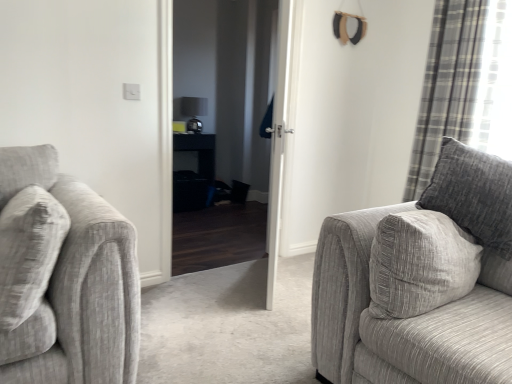
Question: Is black glossy table at center wider than white glossy door at center?

Choices:
 (A) no
 (B) yes

Answer: (B)

Question: Considering the relative sizes of black glossy table at center and white glossy door at center in the image provided, is black glossy table at center smaller than white glossy door at center?

Choices:
 (A) yes
 (B) no

Answer: (A)

Question: Does black glossy table at center appear on the left side of white glossy door at center?

Choices:
 (A) yes
 (B) no

Answer: (A)

Question: Does black glossy table at center have a lesser width compared to white glossy door at center?

Choices:
 (A) yes
 (B) no

Answer: (B)

Question: From a real-world perspective, is black glossy table at center positioned over white glossy door at center based on gravity?

Choices:
 (A) yes
 (B) no

Answer: (B)

Question: From a real-world perspective, is black glossy table at center located beneath white glossy door at center?

Choices:
 (A) yes
 (B) no

Answer: (A)

Question: From the image's perspective, is plaid fabric curtain at right above black glossy door at center?

Choices:
 (A) yes
 (B) no

Answer: (A)

Question: From the image's perspective, would you say plaid fabric curtain at right is shown under black glossy door at center?

Choices:
 (A) yes
 (B) no

Answer: (B)

Question: Is plaid fabric curtain at right far from black glossy door at center?

Choices:
 (A) yes
 (B) no

Answer: (A)

Question: Can you confirm if plaid fabric curtain at right is smaller than black glossy door at center?

Choices:
 (A) yes
 (B) no

Answer: (A)

Question: Considering the relative positions of plaid fabric curtain at right and black glossy door at center in the image provided, is plaid fabric curtain at right to the left of black glossy door at center from the viewer's perspective?

Choices:
 (A) yes
 (B) no

Answer: (B)

Question: Is black glossy door at center located within plaid fabric curtain at right?

Choices:
 (A) no
 (B) yes

Answer: (A)

Question: From the image's perspective, does plaid fabric curtain at right appear higher than white glossy door at center?

Choices:
 (A) yes
 (B) no

Answer: (A)